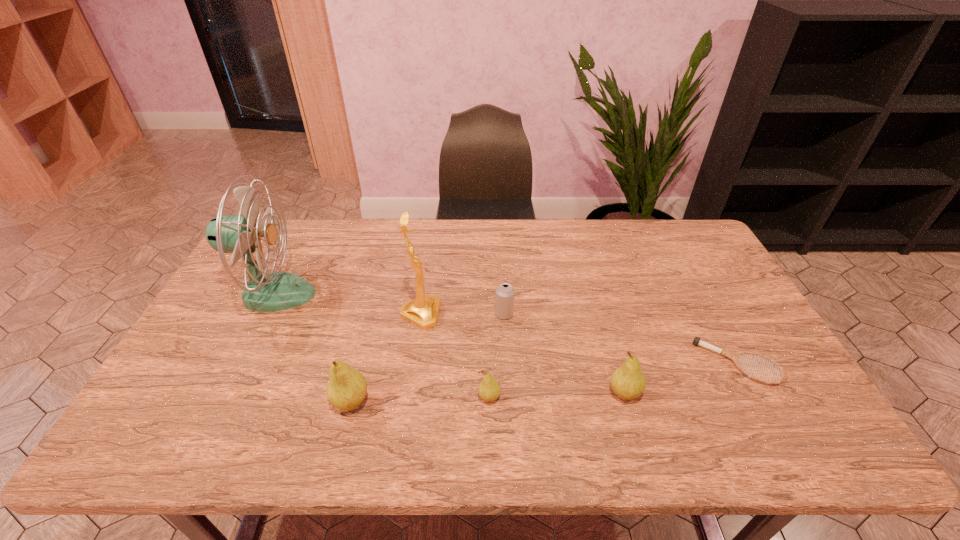
Locate an element on the screen. vacant space at the far edge of the desktop is located at coordinates (564, 241).

The image size is (960, 540). What are the coordinates of `free space at the near edge of the desktop` in the screenshot? It's located at (718, 394).

I want to click on blank space at the right edge, so click(x=708, y=307).

Find the location of a particular element. This screenshot has height=540, width=960. vacant space at the far right corner of the desktop is located at coordinates (682, 256).

Locate an element on the screen. free space between the fifth object from right to left and the fourth shortest object is located at coordinates (522, 354).

At what (x,y) coordinates should I click in order to perform the action: click on free space between the sixth object from left to right and the shortest pear. Please return your answer as a coordinate pair (x, y). The width and height of the screenshot is (960, 540). Looking at the image, I should click on (557, 396).

Locate an element on the screen. free space between the leftmost pear and the third object from left to right is located at coordinates (386, 359).

You are a GUI agent. You are given a task and a screenshot of the screen. Output one action in this format:
    pyautogui.click(x=<x>, y=<y>)
    Task: Click on the empty space between the award and the fourth tallest object
    The height and width of the screenshot is (540, 960).
    Given the screenshot: What is the action you would take?
    pyautogui.click(x=522, y=354)

The image size is (960, 540). What are the coordinates of `free space between the tennis racket and the award` in the screenshot? It's located at (579, 339).

The image size is (960, 540). In order to click on vacant area between the leftmost pear and the second pear from left to right in this screenshot , I will do `click(420, 400)`.